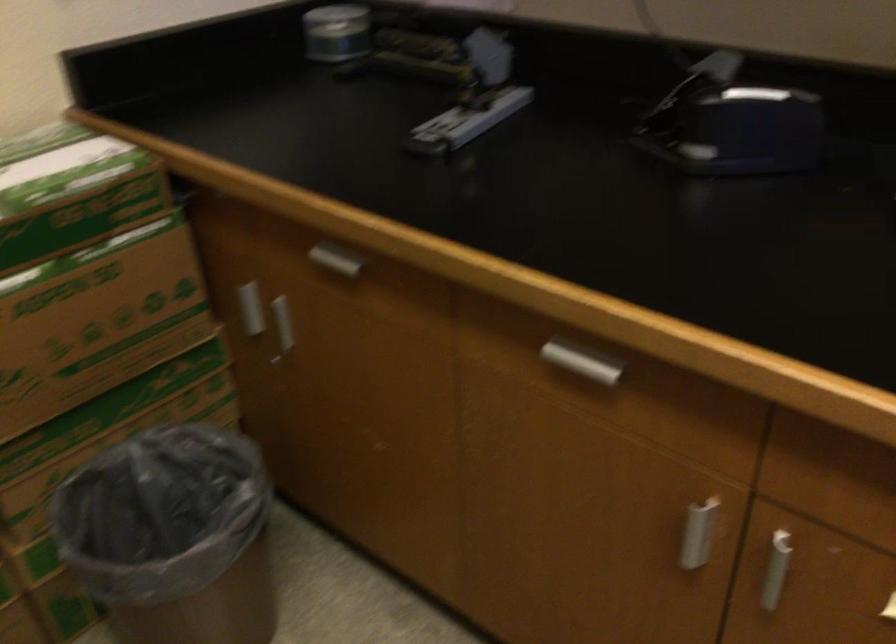
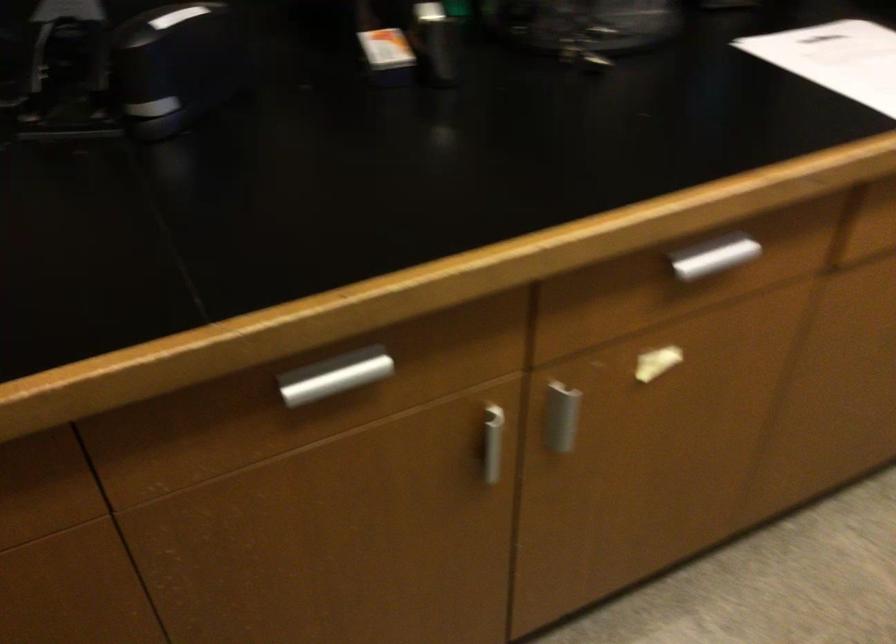
Where in the second image is the point corresponding to (x=776, y=565) from the first image?

(561, 415)